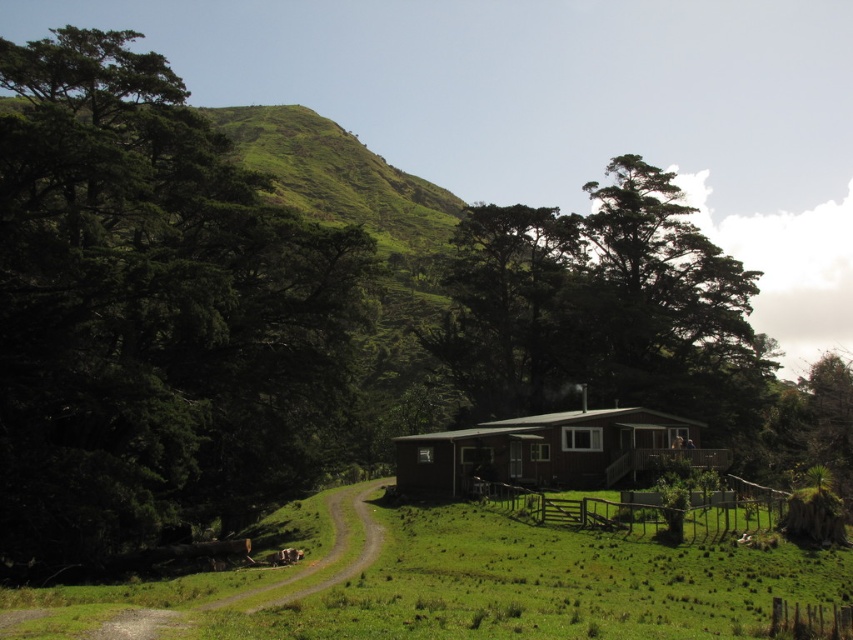
Does point (42, 611) lie behind point (659, 312)?

No, it is in front of (659, 312).

Measure the distance between point [343,620] and camera.

Point [343,620] is 19.60 meters away from camera.

You are a GUI agent. You are given a task and a screenshot of the screen. Output one action in this format:
    pyautogui.click(x=<x>, y=<y>)
    Task: Click on the green grassy field at center
    Image resolution: width=853 pixels, height=640 pixels.
    Given the screenshot: What is the action you would take?
    pyautogui.click(x=456, y=582)

Is green leafy tree at left wider than brown wooden hut at center?

Correct, the width of green leafy tree at left exceeds that of brown wooden hut at center.

Can you confirm if green leafy tree at left is positioned above brown wooden hut at center?

Indeed, green leafy tree at left is positioned over brown wooden hut at center.

Image resolution: width=853 pixels, height=640 pixels. What do you see at coordinates (151, 310) in the screenshot? I see `green leafy tree at left` at bounding box center [151, 310].

Image resolution: width=853 pixels, height=640 pixels. Find the location of `green leafy tree at left`. green leafy tree at left is located at coordinates click(151, 310).

Which is below, green grassy field at center or brown fur dog at lower center?

Positioned lower is brown fur dog at lower center.

Does green grassy field at center have a lesser height compared to brown fur dog at lower center?

No.

Between point (196, 627) and point (292, 556), which one is positioned in front?

Point (196, 627) is more forward.

Where is `green grassy field at center`? This screenshot has width=853, height=640. green grassy field at center is located at coordinates (456, 582).